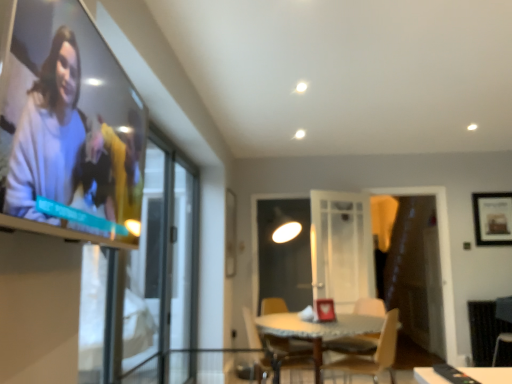
Find the location of a particular element. transparent glass screen door at left, which is the 1th screen door in back-to-front order is located at coordinates (183, 273).

This screenshot has width=512, height=384. What do you see at coordinates (492, 218) in the screenshot? I see `wooden framed picture at upper right` at bounding box center [492, 218].

What is the approximate height of wooden chair at center, the 1th chair positioned from the right?

It is 24.80 inches.

Where is `wooden chair at center, the 1th chair positioned from the right`? Image resolution: width=512 pixels, height=384 pixels. wooden chair at center, the 1th chair positioned from the right is located at coordinates (374, 354).

Describe the element at coordinates (504, 309) in the screenshot. I see `dark brown leather armchair at lower right` at that location.

Describe the element at coordinates (268, 325) in the screenshot. I see `wooden chair at lower center, the first chair when ordered from left to right` at that location.

Describe the element at coordinates (165, 269) in the screenshot. I see `transparent glass screen door at left, acting as the 1th screen door starting from the front` at that location.

The image size is (512, 384). I want to click on transparent glass screen door at left, which is the 1th screen door in back-to-front order, so click(x=183, y=273).

Does matte white sweater at upper left touch wooden chair at lower center, the second chair from the right?

No.

Would you say matte white sweater at upper left contains wooden chair at lower center, the first chair when ordered from left to right?

No, wooden chair at lower center, the first chair when ordered from left to right, is located outside of matte white sweater at upper left.

Which of these two, matte white sweater at upper left or wooden chair at lower center, the second chair from the right, stands shorter?

With less height is matte white sweater at upper left.

This screenshot has height=384, width=512. I want to click on person above the wooden chair at lower center, the second chair from the right (from the image's perspective), so click(58, 144).

Which is more to the right, matte white sweater at upper left or wooden chair at center, the 1th chair positioned from the right?

From the viewer's perspective, wooden chair at center, the 1th chair positioned from the right, appears more on the right side.

How different are the orientations of matte white sweater at upper left and wooden chair at center, the second chair positioned from the left, in degrees?

The facing directions of matte white sweater at upper left and wooden chair at center, the second chair positioned from the left, are 151 degrees apart.

Is matte white sweater at upper left positioned beyond the bounds of wooden chair at center, the 1th chair positioned from the right?

Indeed, matte white sweater at upper left is completely outside wooden chair at center, the 1th chair positioned from the right.

Where is `person on the left of wooden chair at center, the second chair positioned from the left`? The image size is (512, 384). person on the left of wooden chair at center, the second chair positioned from the left is located at coordinates (58, 144).

In the image, is transparent glass screen door at left, which is the 1th screen door in back-to-front order, positioned in front of or behind transparent glass screen door at left, acting as the 1th screen door starting from the front?

transparent glass screen door at left, which is the 1th screen door in back-to-front order, is behind transparent glass screen door at left, acting as the 1th screen door starting from the front.

You are a GUI agent. You are given a task and a screenshot of the screen. Output one action in this format:
    pyautogui.click(x=<x>, y=<y>)
    Task: Click on the screen door located underneath the transparent glass screen door at left, acting as the 1th screen door starting from the front (from a real-world perspective)
    This screenshot has height=384, width=512.
    Given the screenshot: What is the action you would take?
    pyautogui.click(x=183, y=273)

In terms of size, does transparent glass screen door at left, which is the 1th screen door in back-to-front order, appear bigger or smaller than transparent glass screen door at left, which is the second screen door from back to front?

Considering their sizes, transparent glass screen door at left, which is the 1th screen door in back-to-front order, takes up more space than transparent glass screen door at left, which is the second screen door from back to front.

Does transparent glass screen door at left, which is the 1th screen door in back-to-front order, contain transparent glass screen door at left, acting as the 1th screen door starting from the front?

No, transparent glass screen door at left, acting as the 1th screen door starting from the front, is located outside of transparent glass screen door at left, which is the 1th screen door in back-to-front order.

Is wooden chair at lower center, the second chair from the right, facing towards transparent glass screen door at left, arranged as the second screen door when viewed from the front?

No, wooden chair at lower center, the second chair from the right, is not facing towards transparent glass screen door at left, arranged as the second screen door when viewed from the front.

Is transparent glass screen door at left, arranged as the second screen door when viewed from the front, completely or partially inside wooden chair at lower center, the second chair from the right?

No.

From the image's perspective, is wooden chair at lower center, the second chair from the right, above transparent glass screen door at left, which is the 1th screen door in back-to-front order?

No, from the image's perspective, wooden chair at lower center, the second chair from the right, is not above transparent glass screen door at left, which is the 1th screen door in back-to-front order.

Which is closer to the camera, (264, 315) or (186, 311)?

Point (264, 315).

From the image's perspective, is matte white sweater at upper left located above clear glass table at center?

Yes, from the image's perspective, matte white sweater at upper left is above clear glass table at center.

From a real-world perspective, which is physically below, matte white sweater at upper left or clear glass table at center?

In real-world perspective, clear glass table at center is lower.

Image resolution: width=512 pixels, height=384 pixels. In order to click on person that is in front of the clear glass table at center in this screenshot , I will do point(58,144).

Based on the photo, can you tell me how much matte white sweater at upper left and clear glass table at center differ in facing direction?

The facing directions of matte white sweater at upper left and clear glass table at center are 2.19 degrees apart.

Considering the relative positions of wooden chair at lower center, the first chair when ordered from left to right, and dark brown leather armchair at lower right in the image provided, is wooden chair at lower center, the first chair when ordered from left to right, to the right of dark brown leather armchair at lower right from the viewer's perspective?

No, wooden chair at lower center, the first chair when ordered from left to right, is not to the right of dark brown leather armchair at lower right.

Is wooden chair at lower center, the second chair from the right, directly adjacent to dark brown leather armchair at lower right?

There is a gap between wooden chair at lower center, the second chair from the right, and dark brown leather armchair at lower right.

Is wooden chair at lower center, the first chair when ordered from left to right, bigger than dark brown leather armchair at lower right?

Yes, wooden chair at lower center, the first chair when ordered from left to right, is bigger than dark brown leather armchair at lower right.

How many degrees apart are the facing directions of wooden chair at center, the second chair positioned from the left, and wooden chair at lower center, the second chair from the right?

131 degrees.

Is wooden chair at center, the 1th chair positioned from the right, not near wooden chair at lower center, the first chair when ordered from left to right?

That's not correct — wooden chair at center, the 1th chair positioned from the right, is a little close to wooden chair at lower center, the first chair when ordered from left to right.

From a real-world perspective, which is physically below, wooden chair at center, the second chair positioned from the left, or wooden chair at lower center, the first chair when ordered from left to right?

wooden chair at lower center, the first chair when ordered from left to right, is physically lower.

Would you say wooden chair at center, the second chair positioned from the left, contains wooden chair at lower center, the second chair from the right?

That's incorrect, wooden chair at lower center, the second chair from the right, is not inside wooden chair at center, the second chair positioned from the left.

Locate an element on the screen. The height and width of the screenshot is (384, 512). person above the wooden chair at lower center, the second chair from the right (from a real-world perspective) is located at coordinates (58, 144).

Where is `the 1st chair positioned below the matte white sweater at upper left (from the image's perspective)`? Image resolution: width=512 pixels, height=384 pixels. the 1st chair positioned below the matte white sweater at upper left (from the image's perspective) is located at coordinates (374, 354).

From the image, which object appears to be nearer to wooden framed picture at upper right, wooden chair at lower center, the second chair from the right, or transparent glass screen door at left, arranged as the second screen door when viewed from the front?

wooden chair at lower center, the second chair from the right.

From the image, which object appears to be nearer to matte white sweater at upper left, wooden chair at lower center, the first chair when ordered from left to right, or dark brown leather armchair at lower right?

wooden chair at lower center, the first chair when ordered from left to right, is closer to matte white sweater at upper left.

Based on their spatial positions, is wooden chair at center, the second chair positioned from the left, or white glossy table at center further from transparent glass screen door at left, arranged as the second screen door when viewed from the front?

white glossy table at center is further to transparent glass screen door at left, arranged as the second screen door when viewed from the front.

In the scene shown: From the image, which object appears to be nearer to wooden chair at lower center, the second chair from the right, transparent glass screen door at left, which is the 1th screen door in back-to-front order, or clear glass table at center?

Among the two, clear glass table at center is located nearer to wooden chair at lower center, the second chair from the right.

From the image, which object appears to be farther from dark brown leather armchair at lower right, wooden framed picture at upper right or matte white sweater at upper left?

matte white sweater at upper left.

Considering their positions, is white glossy table at center positioned further to transparent glass screen door at left, arranged as the second screen door when viewed from the front, than wooden chair at center, the 1th chair positioned from the right?

Among the two, white glossy table at center is located further to transparent glass screen door at left, arranged as the second screen door when viewed from the front.

Which object lies further to the anchor point wooden chair at center, the second chair positioned from the left, wooden framed picture at upper right or wooden chair at lower center, the second chair from the right?

wooden framed picture at upper right lies further to wooden chair at center, the second chair positioned from the left, than the other object.

Estimate the real-world distances between objects in this image. Which object is further from matte white sweater at upper left, dark brown leather armchair at lower right or transparent glass screen door at left, which is the 1th screen door in back-to-front order?

dark brown leather armchair at lower right.

This screenshot has height=384, width=512. Identify the location of chair between white glossy table at center and clear glass table at center from front to back. (374, 354).

Identify the location of glass table between transparent glass screen door at left, acting as the 1th screen door starting from the front, and wooden framed picture at upper right. (317, 329).

Where is `table between transparent glass screen door at left, acting as the 1th screen door starting from the front, and dark brown leather armchair at lower right, in the horizontal direction`? Image resolution: width=512 pixels, height=384 pixels. table between transparent glass screen door at left, acting as the 1th screen door starting from the front, and dark brown leather armchair at lower right, in the horizontal direction is located at coordinates (489, 374).

Where is `armchair between wooden chair at center, the second chair positioned from the left, and wooden framed picture at upper right`? armchair between wooden chair at center, the second chair positioned from the left, and wooden framed picture at upper right is located at coordinates (504, 309).